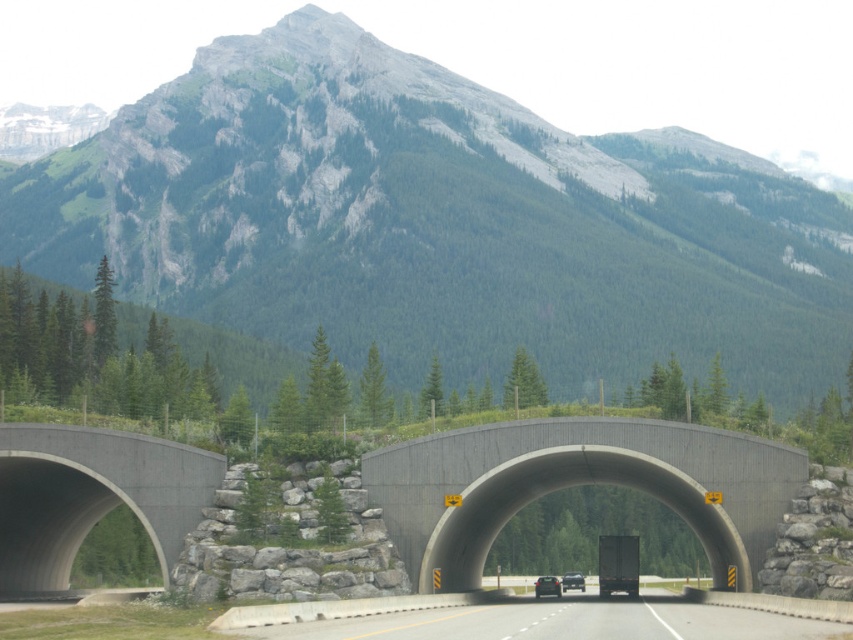
Question: Is gray concrete tunnel at left positioned behind black glossy truck at center?

Choices:
 (A) no
 (B) yes

Answer: (A)

Question: Which object is the closest to the gray concrete overpass at center?

Choices:
 (A) matte black car at center
 (B) black glossy truck at center
 (C) green rock mountain at upper center

Answer: (A)

Question: From the image, what is the correct spatial relationship of green rock mountain at upper center in relation to gray concrete overpass at center?

Choices:
 (A) right
 (B) left

Answer: (B)

Question: Estimate the real-world distances between objects in this image. Which object is closer to the gray concrete overpass at center?

Choices:
 (A) gray concrete tunnel at left
 (B) black glossy truck at center

Answer: (A)

Question: Which object appears farthest from the camera in this image?

Choices:
 (A) gray concrete highway at center
 (B) gray concrete overpass at center

Answer: (B)

Question: Is gray concrete tunnel at left further to the viewer compared to matte black car at center?

Choices:
 (A) yes
 (B) no

Answer: (B)